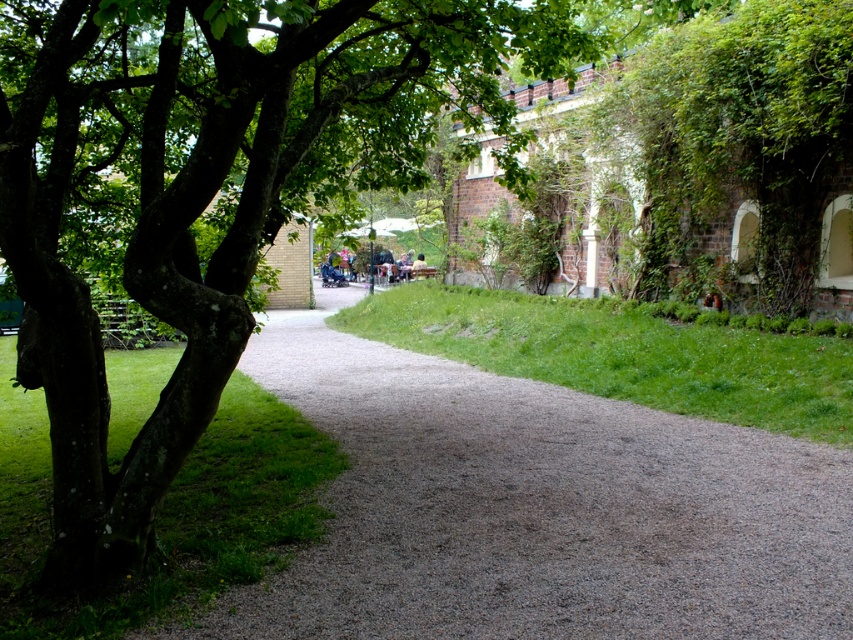
Question: From the image, what is the correct spatial relationship of gray gravel path at center in relation to green grass at center?

Choices:
 (A) right
 (B) left

Answer: (B)

Question: Can you confirm if gray gravel path at center is positioned above green grass at left?

Choices:
 (A) yes
 (B) no

Answer: (B)

Question: Which of the following is the closest to the observer?

Choices:
 (A) green grass at left
 (B) gray gravel path at center

Answer: (B)

Question: Can you confirm if gray gravel path at center is bigger than green grass at left?

Choices:
 (A) no
 (B) yes

Answer: (A)

Question: Which point is closer to the camera?

Choices:
 (A) (171, 515)
 (B) (740, 444)

Answer: (A)

Question: Which point is farther from the camera taking this photo?

Choices:
 (A) (277, 520)
 (B) (300, 634)

Answer: (A)